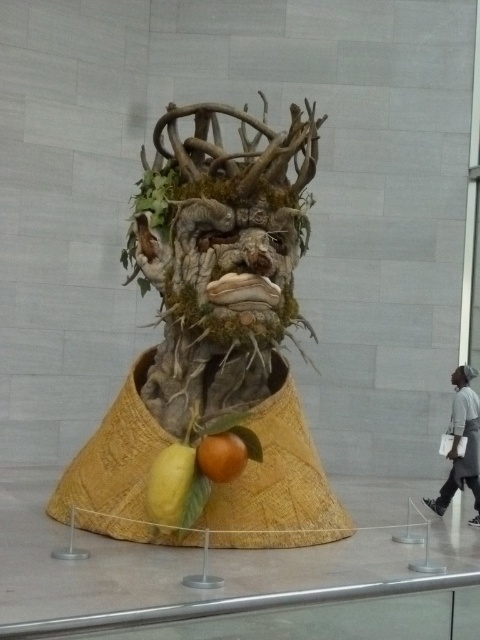
Is wooden sculpture at center smaller than orange matte at lower center?

Incorrect, wooden sculpture at center is not smaller in size than orange matte at lower center.

Can you confirm if wooden sculpture at center is shorter than orange matte at lower center?

No.

What do you see at coordinates (215, 340) in the screenshot? The height and width of the screenshot is (640, 480). I see `wooden sculpture at center` at bounding box center [215, 340].

You are a GUI agent. You are given a task and a screenshot of the screen. Output one action in this format:
    pyautogui.click(x=<x>, y=<y>)
    Task: Click on the wooden sculpture at center
    This screenshot has height=640, width=480.
    Given the screenshot: What is the action you would take?
    pyautogui.click(x=215, y=340)

Who is more forward, (476, 481) or (456, 378)?

Point (476, 481) is more forward.

Which of these two, gray fabric jacket at lower right or white matte face at center, stands shorter?

Standing shorter between the two is white matte face at center.

What do you see at coordinates (465, 449) in the screenshot?
I see `gray fabric jacket at lower right` at bounding box center [465, 449].

Find the location of a particular element. gray fabric jacket at lower right is located at coordinates (465, 449).

Does point (278, 205) come farther from viewer compared to point (459, 372)?

That is False.

Does wooden sculpture at center have a lesser width compared to matte brown mask at center?

No.

What do you see at coordinates (215, 340) in the screenshot?
I see `wooden sculpture at center` at bounding box center [215, 340].

At what (x,y) coordinates should I click in order to perform the action: click on wooden sculpture at center. Please return your answer as a coordinate pair (x, y). This screenshot has height=640, width=480. Looking at the image, I should click on (215, 340).